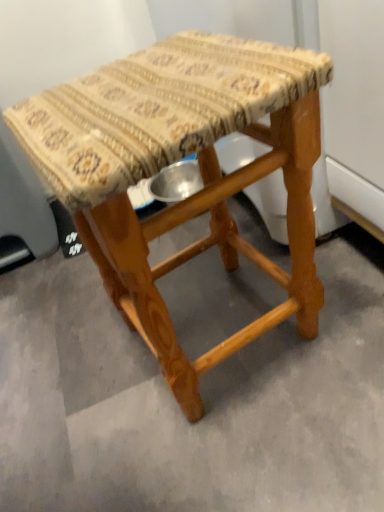
Find the location of `vacant point above wooden stool at center (from a real-world perspective)`. vacant point above wooden stool at center (from a real-world perspective) is located at coordinates (143, 79).